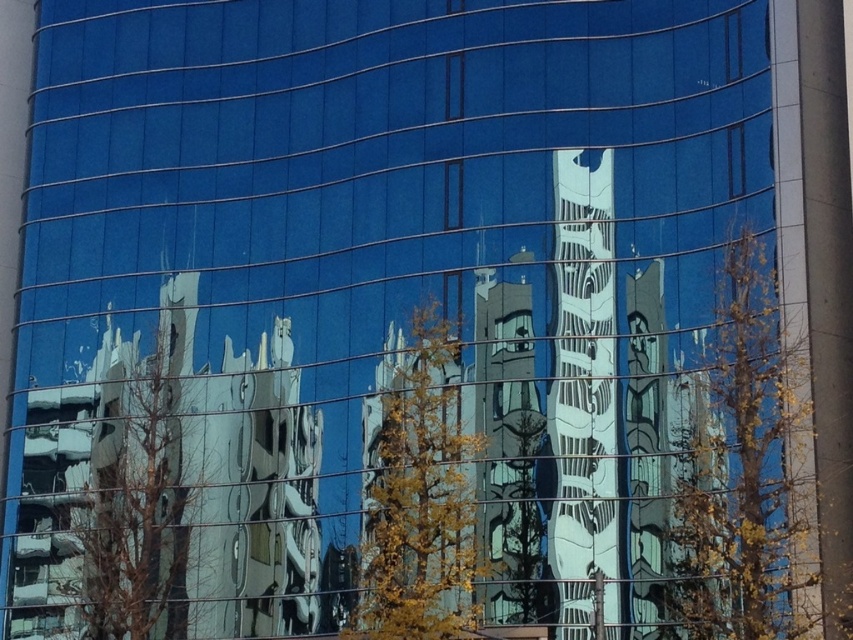
Is brown leafy tree at left shorter than yellow-green leaves at center?

Incorrect, brown leafy tree at left's height does not fall short of yellow-green leaves at center's.

Does brown leafy tree at left appear over yellow-green leaves at center?

Yes.

Who is more forward, (105, 369) or (393, 396)?

Point (393, 396)

You are a GUI agent. You are given a task and a screenshot of the screen. Output one action in this format:
    pyautogui.click(x=<x>, y=<y>)
    Task: Click on the brown leafy tree at left
    The width and height of the screenshot is (853, 640).
    Given the screenshot: What is the action you would take?
    pyautogui.click(x=143, y=497)

Does yellow leafy tree at right have a greater width compared to yellow-green leaves at center?

Indeed, yellow leafy tree at right has a greater width compared to yellow-green leaves at center.

Is yellow leafy tree at right bigger than yellow-green leaves at center?

Correct, yellow leafy tree at right is larger in size than yellow-green leaves at center.

Find the location of a particular element. This screenshot has height=640, width=853. yellow leafy tree at right is located at coordinates (746, 472).

Which is more to the right, yellow leafy tree at right or green matte tree at center?

yellow leafy tree at right is more to the right.

Who is more forward, (720, 508) or (503, 548)?

Point (720, 508) is more forward.

Looking at this image, who is more distant from viewer, (747,588) or (509,492)?

Point (509,492)

Where is `yellow leafy tree at right`? This screenshot has height=640, width=853. yellow leafy tree at right is located at coordinates (746, 472).